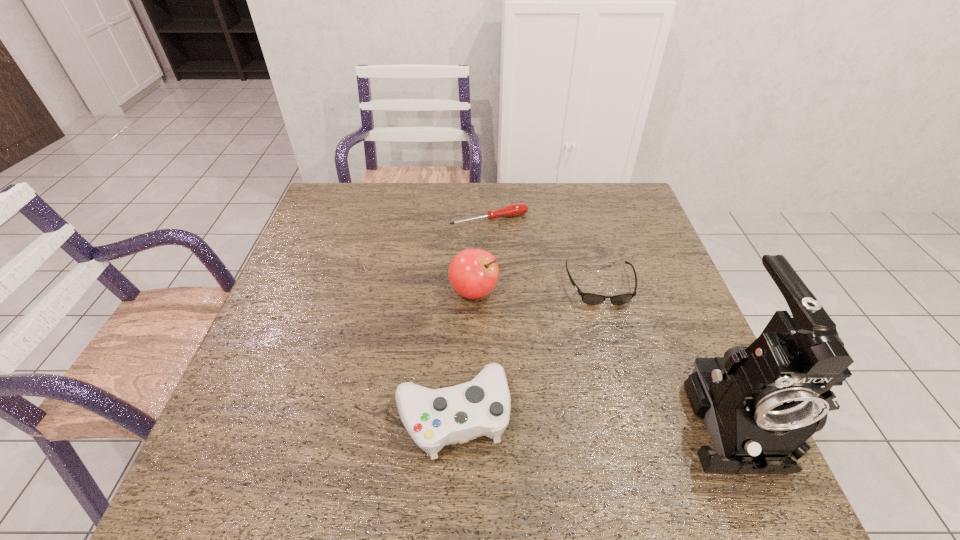
You are a GUI agent. You are given a task and a screenshot of the screen. Output one action in this format:
    pyautogui.click(x=<x>, y=<y>)
    Task: Click on the control
    This screenshot has height=540, width=960.
    Given the screenshot: What is the action you would take?
    pyautogui.click(x=434, y=418)

Locate an element on the screen. This screenshot has height=540, width=960. the tallest object is located at coordinates (761, 403).

Find the location of `screwdriver`. screwdriver is located at coordinates (517, 209).

Where is `the farthest object`? Image resolution: width=960 pixels, height=540 pixels. the farthest object is located at coordinates (517, 209).

Find the location of a particular element. the fourth shortest object is located at coordinates click(473, 273).

The height and width of the screenshot is (540, 960). I want to click on the second shortest object, so click(589, 298).

Identify the location of blank space located on the right of the control. (666, 414).

This screenshot has width=960, height=540. Identify the location of vacant space located at the tip of the screwdriver. (519, 255).

Find the location of a particular element. vacant space located 0.150m at the tip of the screwdriver is located at coordinates (522, 260).

Locate an element on the screen. blank area located at the tip of the screwdriver is located at coordinates (532, 276).